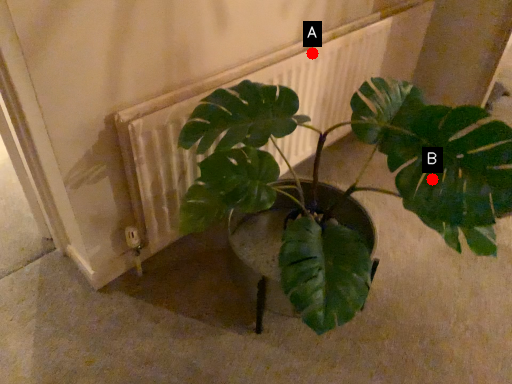
Question: Two points are circled on the image, labeled by A and B beside each circle. Among these points, which one is nearest to the camera?

Choices:
 (A) A is closer
 (B) B is closer

Answer: (B)